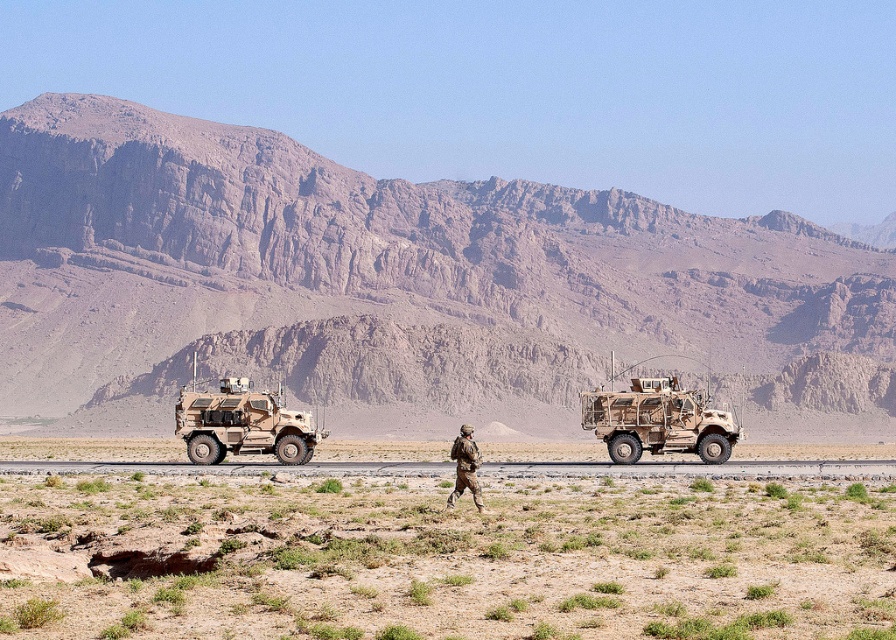
Question: From the image, what is the correct spatial relationship of brown rocky mountain at upper center in relation to camouflage fabric vehicle at center?

Choices:
 (A) below
 (B) above

Answer: (B)

Question: Which point is closer to the camera taking this photo?

Choices:
 (A) (616, 420)
 (B) (279, 419)
 (C) (251, 298)
 (D) (472, 468)

Answer: (D)

Question: Which point is farther to the camera?

Choices:
 (A) (700, 406)
 (B) (375, 630)
 (C) (474, 461)
 (D) (221, 420)

Answer: (A)

Question: Is camouflage fabric armored vehicle at center below camouflage fabric uniform at center?

Choices:
 (A) no
 (B) yes

Answer: (A)

Question: Among these points, which one is farthest from the camera?

Choices:
 (A) (289, 458)
 (B) (46, 580)

Answer: (A)

Question: Can you confirm if camouflage fabric armored vehicle at center is positioned to the left of camouflage fabric uniform at center?

Choices:
 (A) yes
 (B) no

Answer: (A)